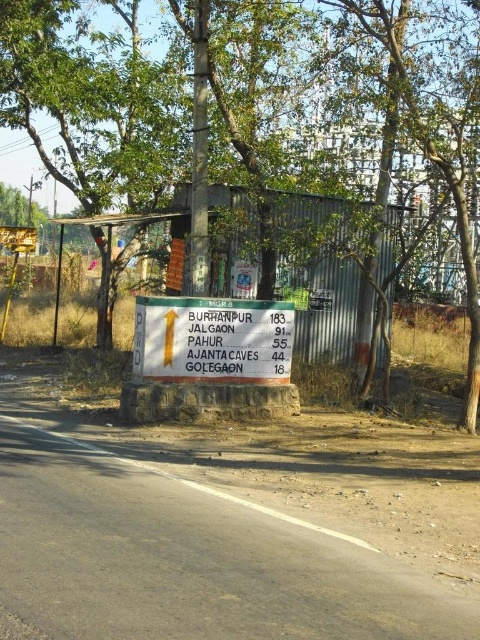
You are standing at point (440, 125) and want to reach the signboard. The signboard is 12.42 meters away from you. If you walk straight towards it, will you have to walk through any obstacles like the corrugated metal structure or the dry grass area?

The signboard is 12.42 meters away from point (440, 125). Since the path between them is clear of obstacles like the corrugated metal structure and only has dry grass, you can walk straight towards the signboard without any hindrance.

You are a traveler standing at the roadside scene. You see a green leafy tree at center and a white plastic sign at center. Which object is higher in elevation?

The green leafy tree at center is positioned over the white plastic sign at center, so it is higher in elevation.